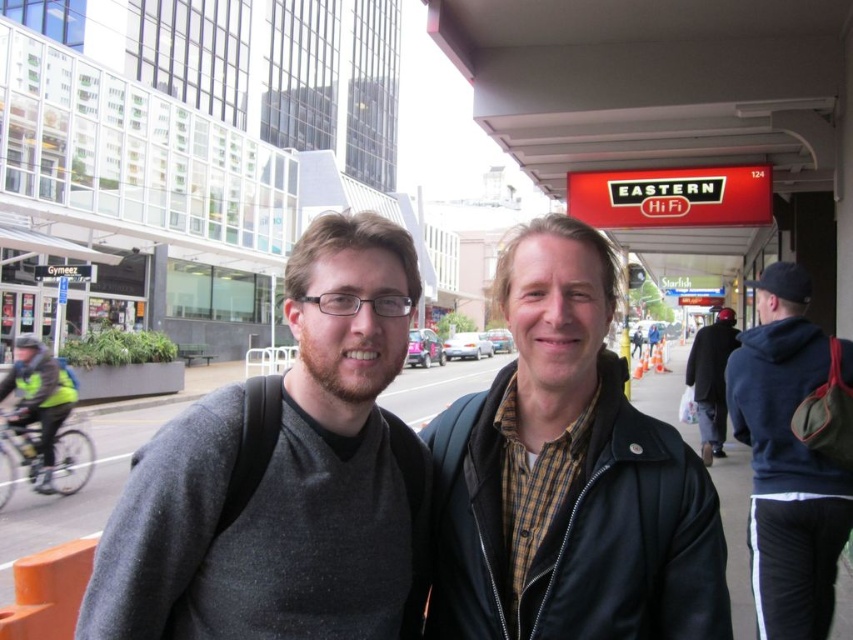
Which is below, dark gray sweater at center or black leather jacket at center?

Positioned lower is dark gray sweater at center.

Can you confirm if dark gray sweater at center is positioned to the left of black leather jacket at center?

Correct, you'll find dark gray sweater at center to the left of black leather jacket at center.

In order to click on dark gray sweater at center in this screenshot , I will do `click(283, 476)`.

Identify the location of dark gray sweater at center. (283, 476).

Is dark gray sweater at center smaller than navy blue hoodie at right?

Yes.

Between point (374, 305) and point (776, 496), which one is positioned behind?

The point (776, 496) is more distant.

Which is in front, point (305, 580) or point (756, 625)?

Positioned in front is point (305, 580).

This screenshot has height=640, width=853. Find the location of `dark gray sweater at center`. dark gray sweater at center is located at coordinates (283, 476).

Can you confirm if navy blue hoodie at right is taller than dark blue jacket at center?

In fact, navy blue hoodie at right may be shorter than dark blue jacket at center.

At what (x,y) coordinates should I click in order to perform the action: click on navy blue hoodie at right. Please return your answer as a coordinate pair (x, y). Image resolution: width=853 pixels, height=640 pixels. Looking at the image, I should click on (787, 461).

What are the coordinates of `navy blue hoodie at right` in the screenshot? It's located at (787, 461).